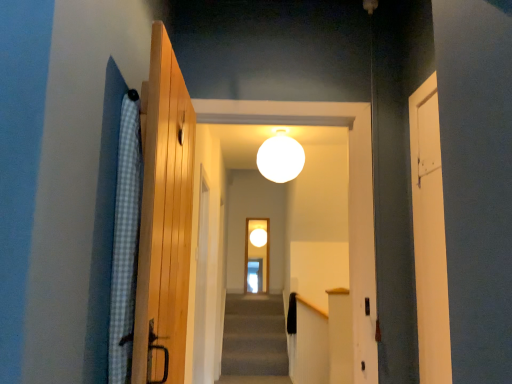
The width and height of the screenshot is (512, 384). What do you see at coordinates (429, 236) in the screenshot?
I see `white matte door at right, the 2th door from the back` at bounding box center [429, 236].

Measure the distance between point (433, 294) and camera.

Point (433, 294) is 5.25 feet away from camera.

Find the location of a particular element. The image size is (512, 384). blue checkered fabric at left is located at coordinates (125, 241).

Image resolution: width=512 pixels, height=384 pixels. What do you see at coordinates (202, 283) in the screenshot?
I see `wooden door at center, which appears as the 3th door when viewed from the front` at bounding box center [202, 283].

Locate an element on the screen. The image size is (512, 384). translucent glass screen door at center is located at coordinates (257, 255).

Which is more to the right, translucent glass screen door at center or wooden door at center, which ranks as the 1th door in back-to-front order?

From the viewer's perspective, translucent glass screen door at center appears more on the right side.

Between translucent glass screen door at center and wooden door at center, which appears as the 3th door when viewed from the front, which one is positioned in front?

wooden door at center, which appears as the 3th door when viewed from the front, is closer to the camera.

From the image's perspective, between translucent glass screen door at center and wooden door at center, which appears as the 3th door when viewed from the front, who is located below?

translucent glass screen door at center.

From their relative heights in the image, would you say translucent glass screen door at center is taller or shorter than wooden door at center, which is the first door in left-to-right order?

In the image, translucent glass screen door at center appears to be shorter than wooden door at center, which is the first door in left-to-right order.

The height and width of the screenshot is (384, 512). Identify the location of screen door on the right of the blue checkered fabric at left. (257, 255).

Is translucent glass screen door at center not inside blue checkered fabric at left?

Result: Yes.

Is translucent glass screen door at center in contact with blue checkered fabric at left?

No.

Considering the relative sizes of translucent glass screen door at center and blue checkered fabric at left in the image provided, is translucent glass screen door at center bigger than blue checkered fabric at left?

Yes, translucent glass screen door at center is bigger than blue checkered fabric at left.

Looking at this image, can you confirm if white matte sphere at center is thinner than translucent glass screen door at center?

No, white matte sphere at center is not thinner than translucent glass screen door at center.

From a real-world perspective, is white matte sphere at center on top of translucent glass screen door at center?

Yes, from a real-world perspective, white matte sphere at center is on top of translucent glass screen door at center.

Is white matte sphere at center positioned behind translucent glass screen door at center?

No, it is in front of translucent glass screen door at center.

Is white matte sphere at center spatially inside translucent glass screen door at center, or outside of it?

white matte sphere at center lies outside translucent glass screen door at center.

From the picture: Based on their sizes in the image, would you say white matte door at right, marked as the first door in a right-to-left arrangement, is bigger or smaller than wooden door at left, which appears as the second door when viewed from the left?

white matte door at right, marked as the first door in a right-to-left arrangement, is smaller than wooden door at left, which appears as the second door when viewed from the left.

From a real-world perspective, is white matte door at right, acting as the 2th door starting from the front, positioned above or below wooden door at left, which appears as the second door when viewed from the left?

In terms of real-world spatial position, white matte door at right, acting as the 2th door starting from the front, is above wooden door at left, which appears as the second door when viewed from the left.

Could you tell me if white matte door at right, acting as the 2th door starting from the front, is turned towards wooden door at left, the 1th door in the front-to-back sequence?

Yes, white matte door at right, acting as the 2th door starting from the front, faces towards wooden door at left, the 1th door in the front-to-back sequence.

In the scene shown: Which point is more forward, (x=444, y=374) or (x=156, y=331)?

The point (x=156, y=331) is closer to the camera.

Does translucent glass screen door at center have a larger size compared to white matte sphere at center?

No, translucent glass screen door at center is not bigger than white matte sphere at center.

Which is closer, (256, 245) or (280, 141)?

Point (280, 141)

Is translucent glass screen door at center thinner than white matte sphere at center?

Yes.

Which of these two, wooden door at left, the 1th door in the front-to-back sequence, or white matte door at right, marked as the first door in a right-to-left arrangement, is wider?

Wider between the two is wooden door at left, the 1th door in the front-to-back sequence.

Looking at this image, is wooden door at left, which appears as the second door when viewed from the left, to the left or to the right of white matte door at right, the 3th door in the left-to-right sequence, in the image?

In the image, wooden door at left, which appears as the second door when viewed from the left, appears on the left side of white matte door at right, the 3th door in the left-to-right sequence.

Consider the image. Is wooden door at left, the 1th door in the front-to-back sequence, inside the boundaries of white matte door at right, the 3th door in the left-to-right sequence, or outside?

wooden door at left, the 1th door in the front-to-back sequence, lies outside white matte door at right, the 3th door in the left-to-right sequence.

Is wooden door at left, which appears as the second door when viewed from the left, oriented towards white matte door at right, acting as the 2th door starting from the front?

Yes, wooden door at left, which appears as the second door when viewed from the left, faces towards white matte door at right, acting as the 2th door starting from the front.

Is blue checkered fabric at left to the right of white matte door at right, marked as the first door in a right-to-left arrangement, from the viewer's perspective?

No, blue checkered fabric at left is not to the right of white matte door at right, marked as the first door in a right-to-left arrangement.

Looking at this image, between blue checkered fabric at left and white matte door at right, acting as the 2th door starting from the front, which one has less height?

Standing shorter between the two is blue checkered fabric at left.

Considering the points (129, 356) and (432, 305), which point is in front, point (129, 356) or point (432, 305)?

Positioned in front is point (129, 356).

Can you confirm if blue checkered fabric at left is bigger than white matte door at right, the 3th door in the left-to-right sequence?

Correct, blue checkered fabric at left is larger in size than white matte door at right, the 3th door in the left-to-right sequence.

At what (x,y) coordinates should I click in order to perform the action: click on the 2nd door to the left when counting from the translucent glass screen door at center. Please return your answer as a coordinate pair (x, y). The height and width of the screenshot is (384, 512). Looking at the image, I should click on (202, 283).

This screenshot has height=384, width=512. Identify the location of curtain above the translucent glass screen door at center (from the image's perspective). (125, 241).

Considering their positions, is translucent glass screen door at center positioned further to white matte door at right, acting as the 2th door starting from the front, than white matte sphere at center?

Based on the image, translucent glass screen door at center appears to be further to white matte door at right, acting as the 2th door starting from the front.

Which object lies further to the anchor point white matte sphere at center, white matte door at right, acting as the 2th door starting from the front, or wooden door at left, which appears as the second door when viewed from the left?

wooden door at left, which appears as the second door when viewed from the left, is positioned further to the anchor white matte sphere at center.

Based on their spatial positions, is white matte sphere at center or white matte door at right, marked as the first door in a right-to-left arrangement, closer to wooden door at center, which ranks as the 1th door in back-to-front order?

Among the two, white matte sphere at center is located nearer to wooden door at center, which ranks as the 1th door in back-to-front order.

From the image, which object appears to be farther from wooden door at left, the third door when ordered from back to front, blue checkered fabric at left or white matte sphere at center?

white matte sphere at center is further to wooden door at left, the third door when ordered from back to front.

From the image, which object appears to be nearer to wooden door at left, the second door positioned from the right, wooden door at center, which is the first door in left-to-right order, or white matte sphere at center?

white matte sphere at center is positioned closer to the anchor wooden door at left, the second door positioned from the right.

Based on their spatial positions, is translucent glass screen door at center or white matte door at right, acting as the 2th door starting from the front, further from wooden door at left, which appears as the second door when viewed from the left?

translucent glass screen door at center is positioned further to the anchor wooden door at left, which appears as the second door when viewed from the left.

Looking at this image, estimate the real-world distances between objects in this image. Which object is closer to white matte sphere at center, blue checkered fabric at left or white matte door at right, the 3th door in the left-to-right sequence?

Among the two, white matte door at right, the 3th door in the left-to-right sequence, is located nearer to white matte sphere at center.

Based on their spatial positions, is wooden door at center, the third door when ordered from right to left, or blue checkered fabric at left further from white matte door at right, acting as the 2th door starting from the front?

Based on the image, wooden door at center, the third door when ordered from right to left, appears to be further to white matte door at right, acting as the 2th door starting from the front.

What are the coordinates of `door between wooden door at left, which appears as the second door when viewed from the left, and wooden door at center, which ranks as the 1th door in back-to-front order, from front to back` in the screenshot? It's located at (429, 236).

The width and height of the screenshot is (512, 384). In order to click on door positioned between white matte door at right, the 2th door from the back, and translucent glass screen door at center from near to far in this screenshot , I will do `click(202, 283)`.

Find the location of a particular element. This screenshot has width=512, height=384. lamp between wooden door at center, the third door when ordered from right to left, and translucent glass screen door at center, along the z-axis is located at coordinates (280, 158).

I want to click on curtain between wooden door at left, which appears as the second door when viewed from the left, and wooden door at center, which is the first door in left-to-right order, from front to back, so click(x=125, y=241).